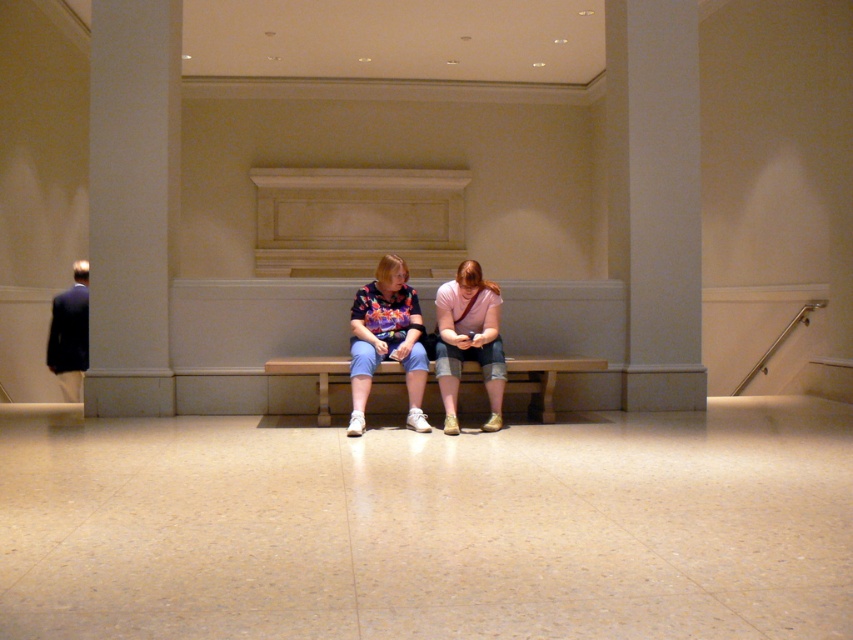
You are standing at the entrance of the museum and see the point marked at coordinates (132, 204). What object is this point located on?

The point marked at coordinates (132, 204) is located on the white marble pillar at left.

You are standing at the entrance of the museum and want to move towards the white marble pillar at left while avoiding the floral fabric shirt at center. Is there enough space between them to walk through?

The distance between the white marble pillar at left and the floral fabric shirt at center is 2.09 meters, which is sufficient for a person to walk through comfortably.

You are standing in the museum and want to take a photo of the white smooth pillar at center and the matte pink shirt at center. Which object is closer to the left side of the frame?

The matte pink shirt at center is closer to the left side of the frame since the white smooth pillar at center is positioned to its right.